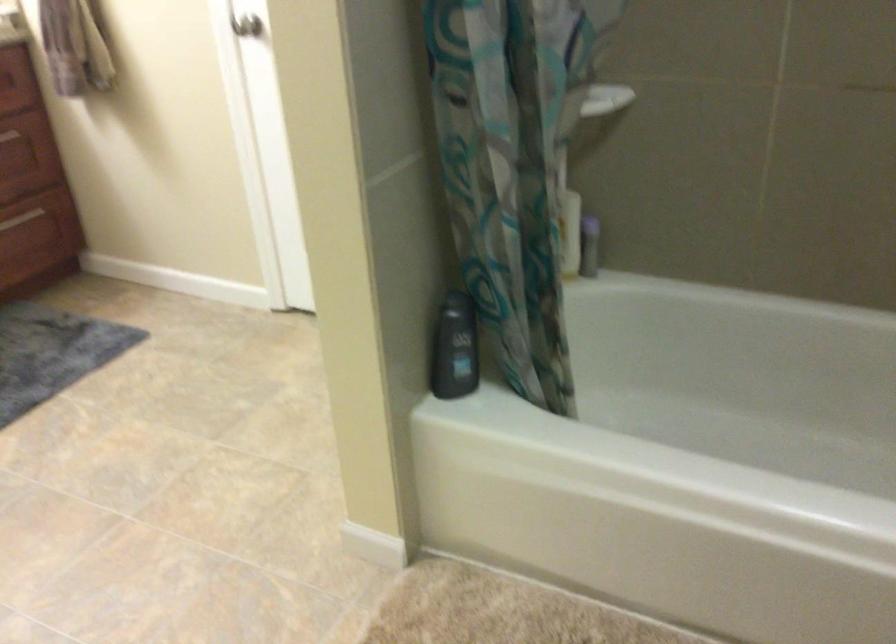
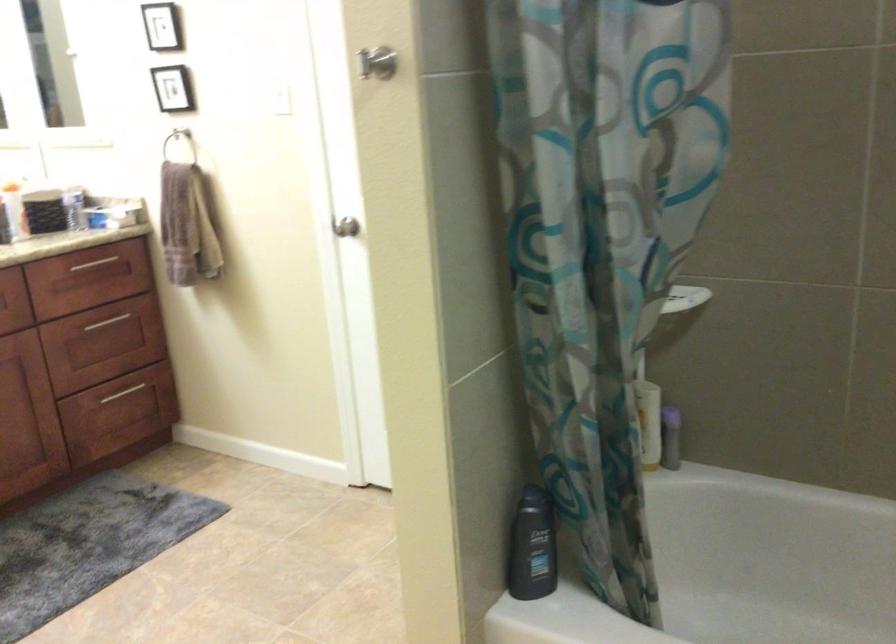
Question: What movement of the cameraman would produce the second image?

Choices:
 (A) Left
 (B) Right
 (C) Forward
 (D) Backward

Answer: (D)